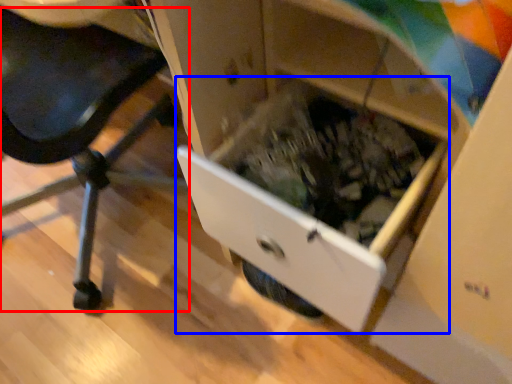
Question: Which object appears farthest to the camera in this image, furniture (highlighted by a red box) or drawer (highlighted by a blue box)?

Choices:
 (A) furniture
 (B) drawer

Answer: (B)